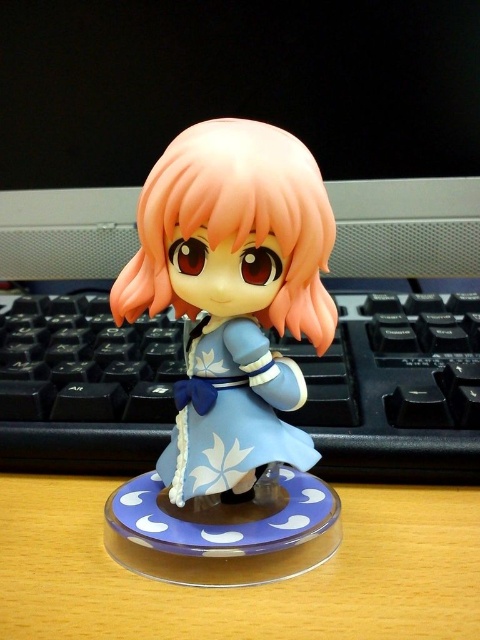
Question: Which point is farther to the camera?

Choices:
 (A) (402, 445)
 (B) (16, 630)
 (C) (133, 566)

Answer: (A)

Question: Can you confirm if matte blue figurine at center is thinner than black plastic keyboard at center?

Choices:
 (A) no
 (B) yes

Answer: (B)

Question: Can you confirm if matte blue figurine at center is wider than wooden computer desk at center?

Choices:
 (A) yes
 (B) no

Answer: (B)

Question: Which point is farther from the camera taking this photo?

Choices:
 (A) (176, 506)
 (B) (33, 404)
 (C) (94, 552)

Answer: (B)

Question: Is matte blue figurine at center positioned behind black plastic keyboard at center?

Choices:
 (A) yes
 (B) no

Answer: (B)

Question: Considering the real-world distances, which object is closest to the matte blue figurine at center?

Choices:
 (A) black plastic keyboard at center
 (B) wooden computer desk at center

Answer: (B)